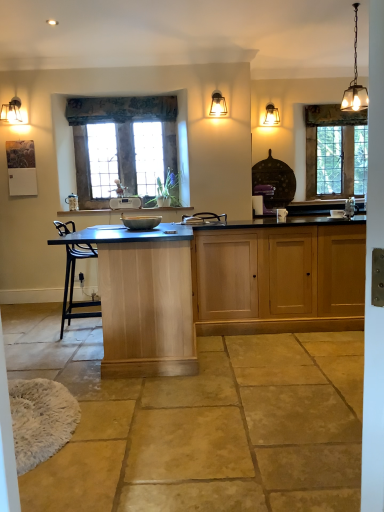
Question: Should I look upward or downward to see textured fabric curtain at upper center?

Choices:
 (A) up
 (B) down

Answer: (A)

Question: Are white plastic toaster at center and textured fabric curtain at upper center located far from each other?

Choices:
 (A) no
 (B) yes

Answer: (B)

Question: Considering the relative sizes of white plastic toaster at center and textured fabric curtain at upper center in the image provided, is white plastic toaster at center thinner than textured fabric curtain at upper center?

Choices:
 (A) yes
 (B) no

Answer: (B)

Question: Is white plastic toaster at center oriented towards textured fabric curtain at upper center?

Choices:
 (A) yes
 (B) no

Answer: (B)

Question: Does white plastic toaster at center lie behind textured fabric curtain at upper center?

Choices:
 (A) no
 (B) yes

Answer: (B)

Question: Is white plastic toaster at center completely or partially outside of textured fabric curtain at upper center?

Choices:
 (A) yes
 (B) no

Answer: (A)

Question: Does white plastic toaster at center appear on the right side of textured fabric curtain at upper center?

Choices:
 (A) no
 (B) yes

Answer: (B)

Question: Can you confirm if white plastic toaster at center is positioned to the right of light wood table at center?

Choices:
 (A) yes
 (B) no

Answer: (B)

Question: Does white plastic toaster at center lie in front of light wood table at center?

Choices:
 (A) yes
 (B) no

Answer: (B)

Question: Can you confirm if white plastic toaster at center is thinner than light wood table at center?

Choices:
 (A) no
 (B) yes

Answer: (B)

Question: Does white plastic toaster at center turn towards light wood table at center?

Choices:
 (A) yes
 (B) no

Answer: (B)

Question: Can you confirm if white plastic toaster at center is bigger than light wood table at center?

Choices:
 (A) no
 (B) yes

Answer: (A)

Question: Can we say white plastic toaster at center lies outside light wood table at center?

Choices:
 (A) yes
 (B) no

Answer: (A)

Question: Considering the relative sizes of white plastic toaster at center and matte black lampshade at upper left in the image provided, is white plastic toaster at center wider than matte black lampshade at upper left?

Choices:
 (A) no
 (B) yes

Answer: (A)